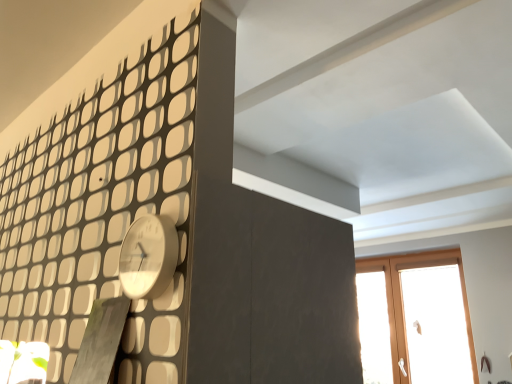
Question: From a real-world perspective, is white glossy clock at upper left physically located above or below wooden window at upper right?

Choices:
 (A) below
 (B) above

Answer: (B)

Question: In the image, is white glossy clock at upper left positioned in front of or behind wooden window at upper right?

Choices:
 (A) behind
 (B) front

Answer: (B)

Question: Is white glossy clock at upper left situated inside wooden window at upper right or outside?

Choices:
 (A) inside
 (B) outside

Answer: (B)

Question: From the image's perspective, relative to white glossy clock at upper left, is wooden window at upper right above or below?

Choices:
 (A) above
 (B) below

Answer: (B)

Question: Is point (394, 370) closer or farther from the camera than point (135, 238)?

Choices:
 (A) farther
 (B) closer

Answer: (A)

Question: Based on their sizes in the image, would you say wooden window at upper right is bigger or smaller than white glossy clock at upper left?

Choices:
 (A) small
 (B) big

Answer: (B)

Question: Considering the positions of wooden window at upper right and white glossy clock at upper left in the image, is wooden window at upper right taller or shorter than white glossy clock at upper left?

Choices:
 (A) short
 (B) tall

Answer: (B)